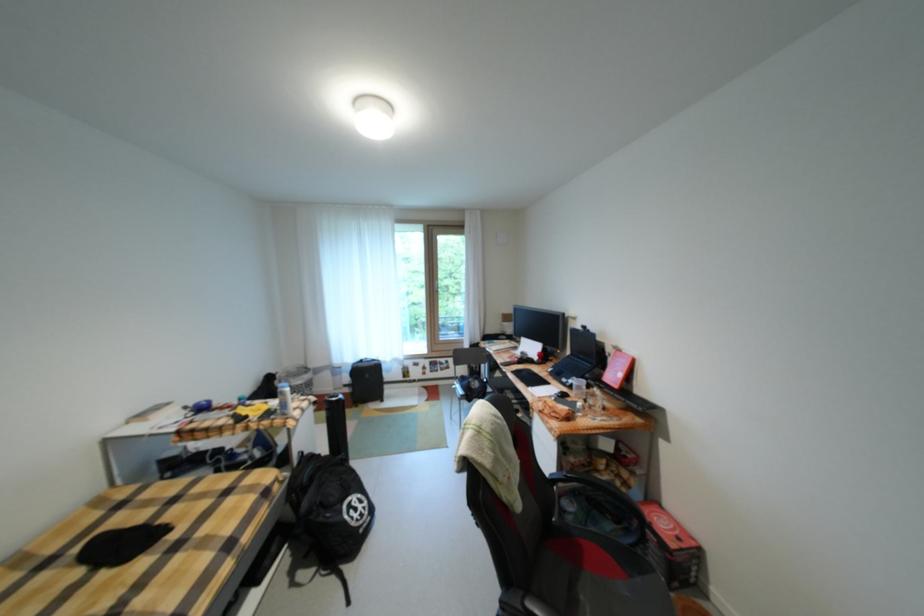
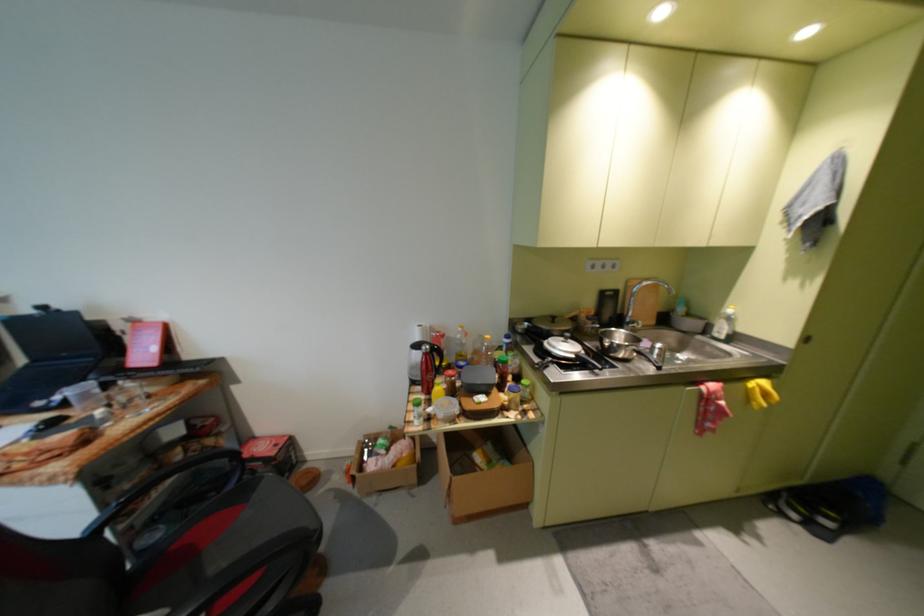
Locate, in the second image, the point that corresponds to point 671,506 in the first image.

(264, 439)